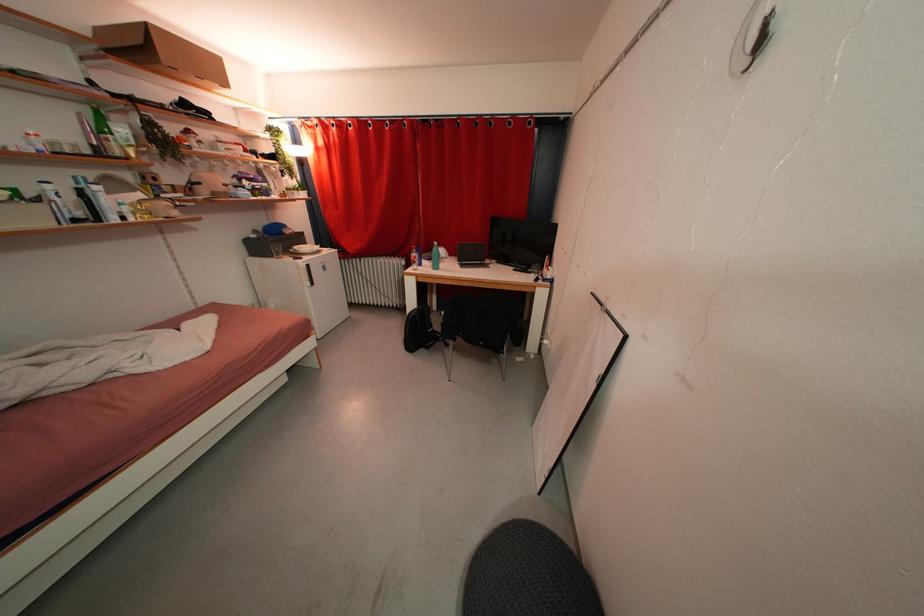
Find the location of a particular element. The image size is (924, 616). black backpack is located at coordinates (419, 330).